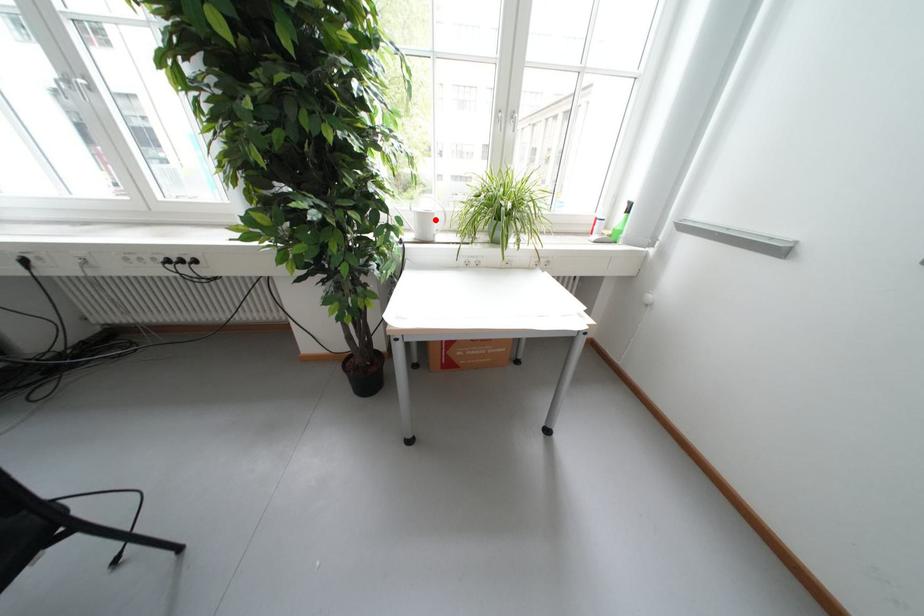
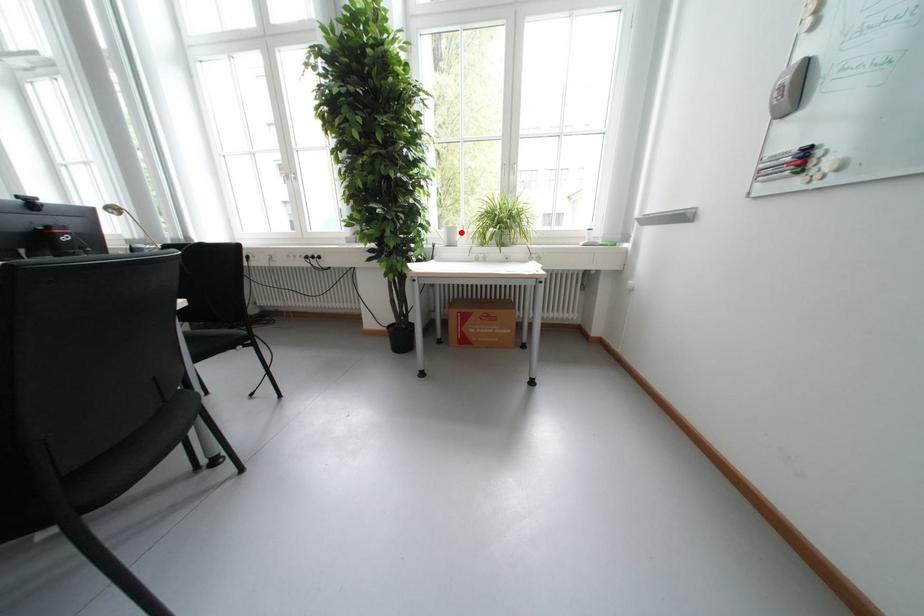
I am providing you with two images of the same scene from different viewpoints. A red point is marked on the first image and another point is marked on the second image. Do the highlighted points in image1 and image2 indicate the same real-world spot?

Yes